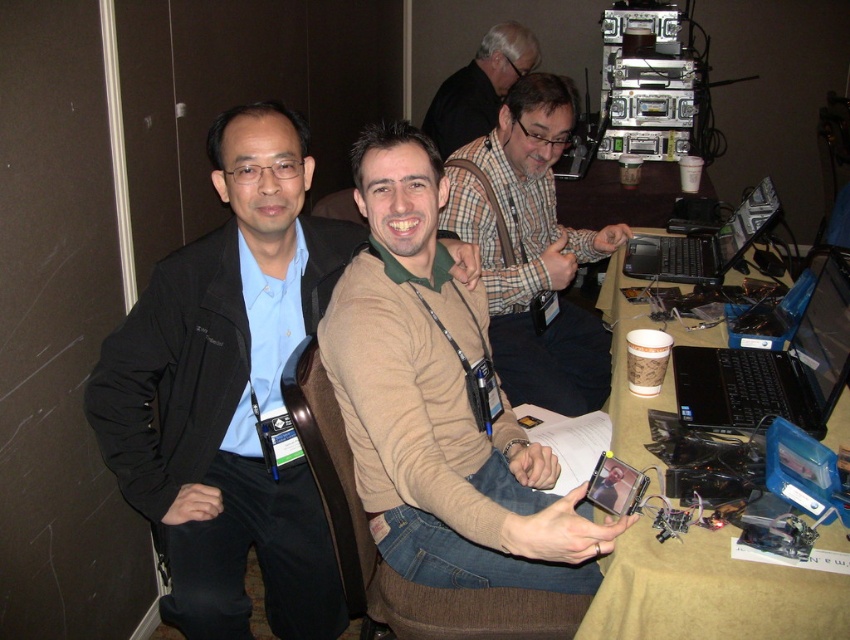
Is point (683, 566) positioned behind point (473, 58)?

No.

Between brown paper table at lower right and plaid shirt at upper center, which one has more height?

Standing taller between the two is brown paper table at lower right.

Measure the distance between brown paper table at lower right and camera.

brown paper table at lower right and camera are 3.55 feet apart.

I want to click on brown paper table at lower right, so click(707, 593).

In the scene shown: Does black plastic laptop at center come behind black plastic laptop at center right?

No, it is not.

The height and width of the screenshot is (640, 850). What are the coordinates of `black plastic laptop at center` in the screenshot? It's located at (774, 369).

At what (x,y) coordinates should I click in order to perform the action: click on black plastic laptop at center. Please return your answer as a coordinate pair (x, y). The width and height of the screenshot is (850, 640). Looking at the image, I should click on (774, 369).

Which of these two, brown paper table at lower right or black plastic laptop at center right, stands shorter?

With less height is black plastic laptop at center right.

Can you confirm if brown paper table at lower right is positioned to the right of black plastic laptop at center right?

Incorrect, brown paper table at lower right is not on the right side of black plastic laptop at center right.

Image resolution: width=850 pixels, height=640 pixels. What do you see at coordinates (707, 593) in the screenshot?
I see `brown paper table at lower right` at bounding box center [707, 593].

In order to click on brown paper table at lower right in this screenshot , I will do `click(707, 593)`.